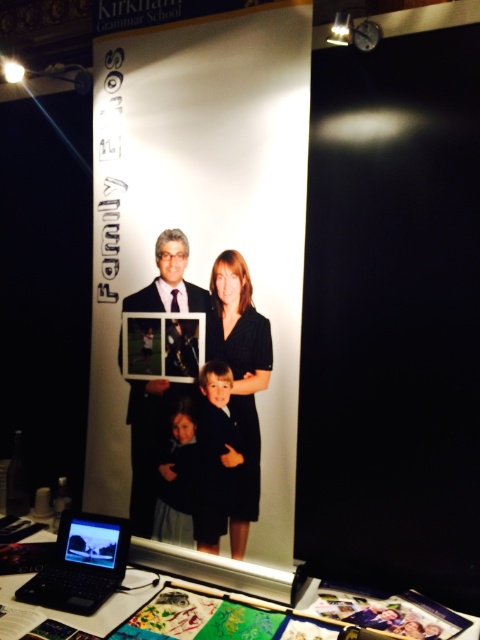
You are standing in front of the display setup at the Kirkham Grammar School event. You need to locate the matte black suit at center. Where exactly is it positioned in terms of coordinates?

The matte black suit at center is located at coordinates (148, 444).

You are standing in front of the display setup at the Kirkham Grammar School event. You notice a point marked at coordinates (x=148, y=444). What object is located at this point?

The point at coordinates (x=148, y=444) marks the location of the matte black suit at center.